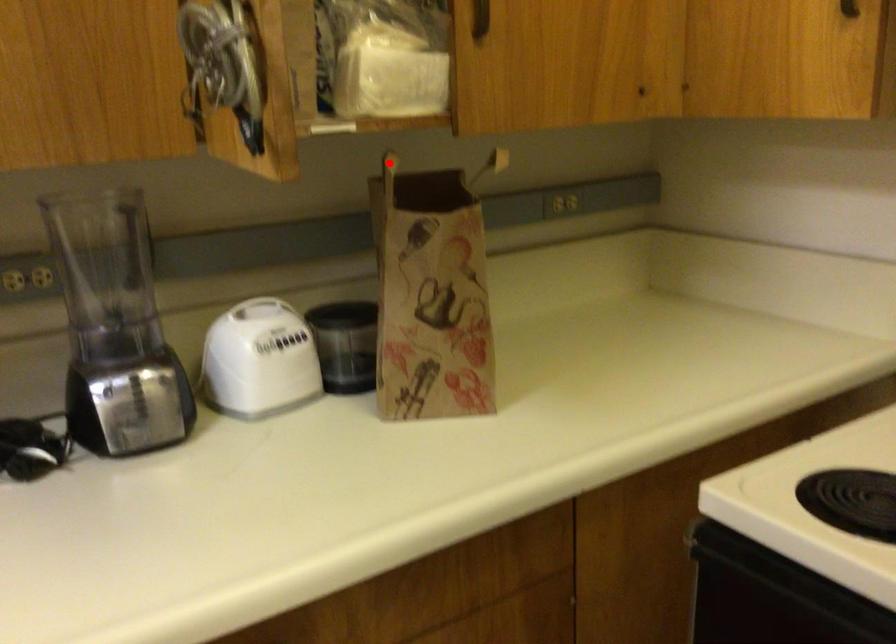
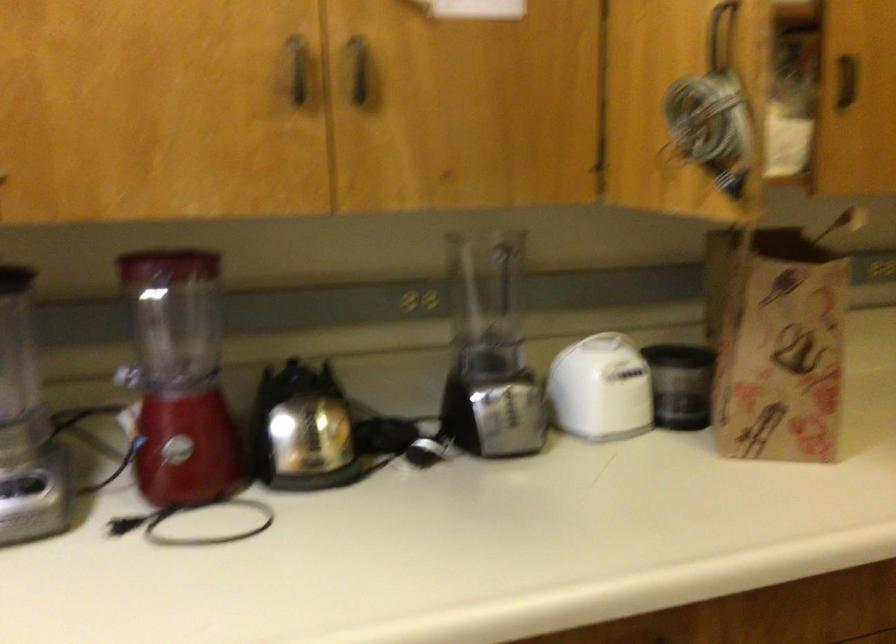
In the second image, find the point that corresponds to the highlighted location in the first image.

(754, 214)